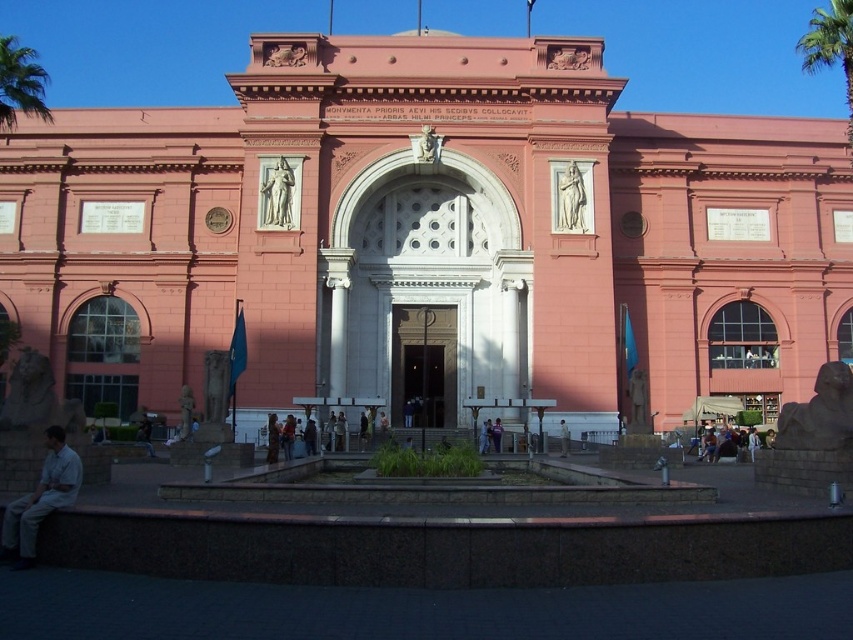
You are a tour guide explaining the Egyptian Museum in Cairo. You point out the green leafy palm tree at upper right and the matte stone statue at upper center. Which of these two objects is located to the right of the other?

The green leafy palm tree at upper right is positioned on the right side of matte stone statue at upper center.

You are standing in front of the Egyptian Museum in Cairo. You see a green leafy palm tree at upper left and dark blue jeans at lower left. Which object is closer to you?

The dark blue jeans at lower left is behind the green leafy palm tree at upper left, so the green leafy palm tree at upper left is closer to you.

You are standing in front of the Egyptian Museum in Cairo and see two pairs of jeans. One is dark blue jeans at lower left and the other is light blue jeans at center. Which pair of jeans is positioned lower in the image?

The dark blue jeans at lower left is positioned lower in the image than the light blue jeans at center.